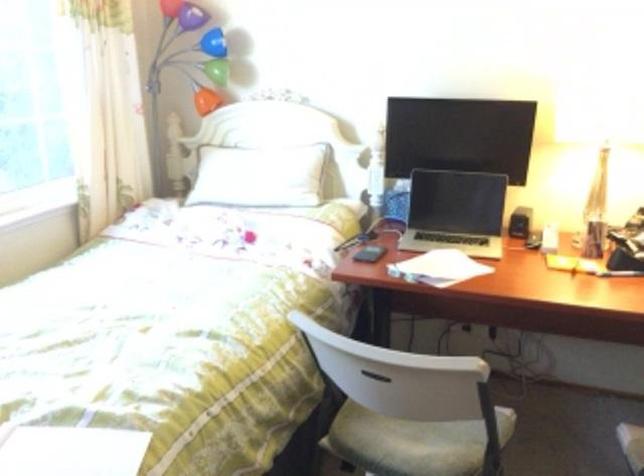
Which object does [518,222] point to?

It refers to a black speaker.